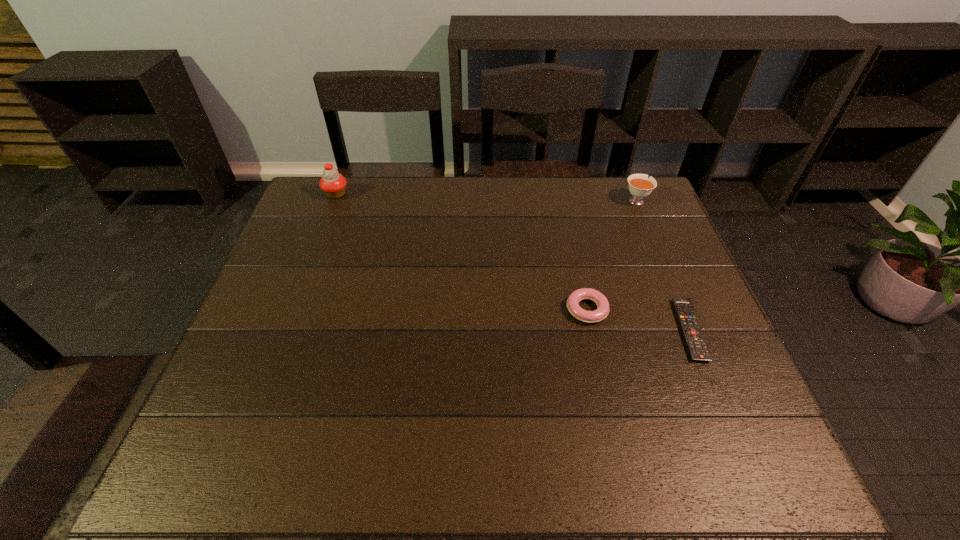
Locate an element on the screen. The image size is (960, 540). the tallest object is located at coordinates (333, 184).

This screenshot has width=960, height=540. In order to click on cupcake in this screenshot , I will do `click(333, 184)`.

Where is `the third shortest object`? the third shortest object is located at coordinates (640, 186).

Identify the location of the third tallest object. 598,298.

Identify the location of the second object from left to right. This screenshot has width=960, height=540. (598, 298).

Locate an element on the screen. The image size is (960, 540). remote control is located at coordinates (698, 350).

You are a GUI agent. You are given a task and a screenshot of the screen. Output one action in this format:
    pyautogui.click(x=<x>, y=<y>)
    Task: Click on the vacant space situated 0.390m on the front of the cupcake
    The height and width of the screenshot is (540, 960).
    Given the screenshot: What is the action you would take?
    pyautogui.click(x=299, y=293)

Locate an element on the screen. The height and width of the screenshot is (540, 960). vacant space located on the side of the second tallest object with the handle is located at coordinates (629, 183).

At what (x,y) coordinates should I click in order to perform the action: click on vacant space located 0.070m on the side of the second tallest object with the handle. Please return your answer as a coordinate pair (x, y). This screenshot has width=960, height=540. Looking at the image, I should click on (627, 179).

This screenshot has width=960, height=540. In order to click on free space located on the left of the third object from right to left in this screenshot , I will do `click(449, 309)`.